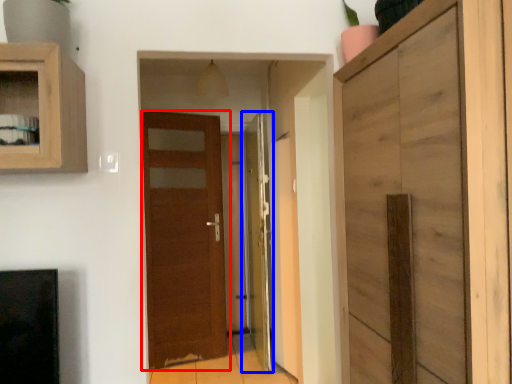
Question: Which object is further to the camera taking this photo, door (highlighted by a red box) or door (highlighted by a blue box)?

Choices:
 (A) door
 (B) door

Answer: (A)